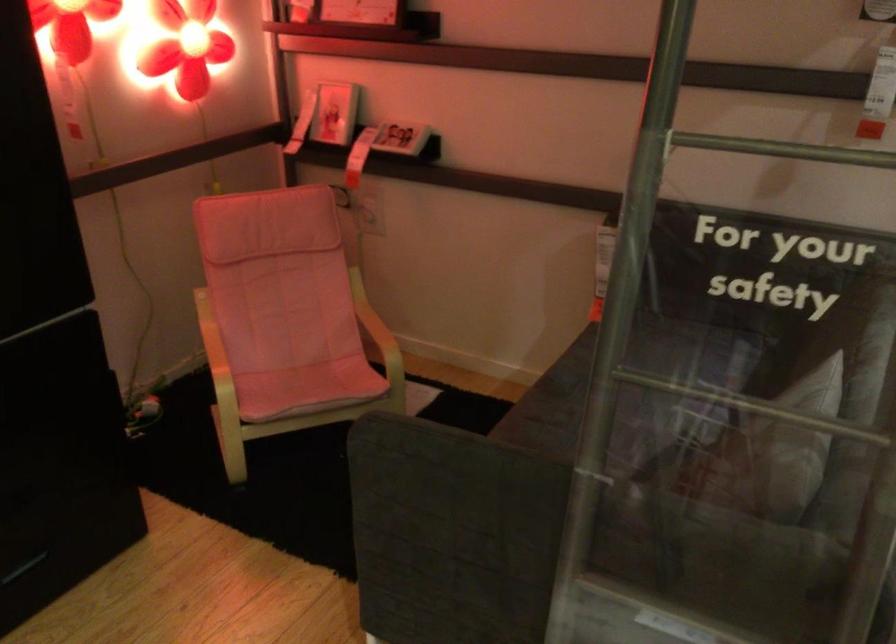
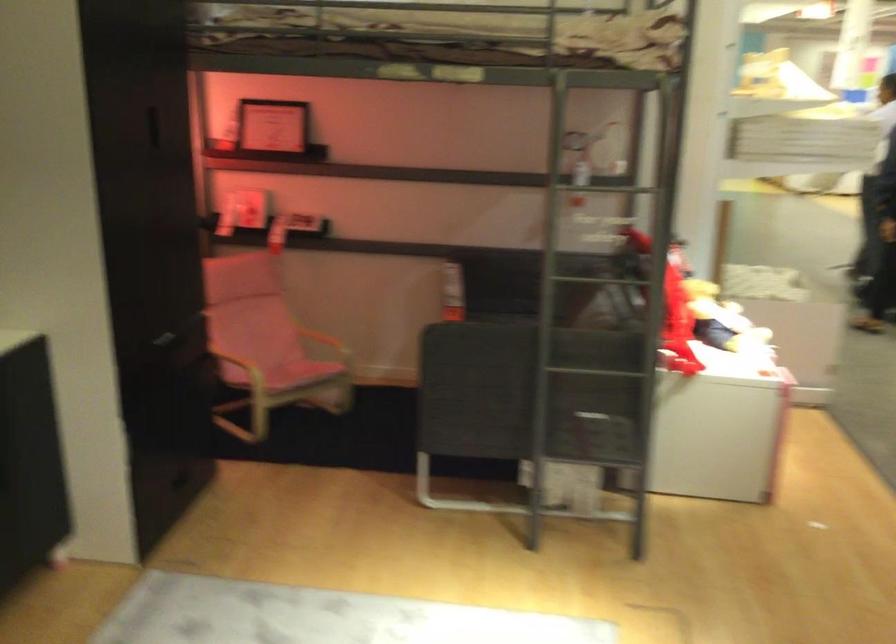
Locate, in the second image, the point that corresponds to (x=676, y=380) in the first image.

(591, 278)